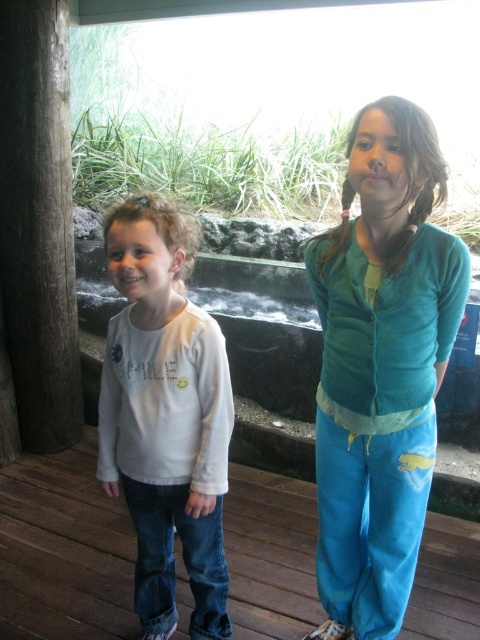
Question: Which point is closer to the camera?

Choices:
 (A) (205, 342)
 (B) (348, 456)
 (C) (275, 545)

Answer: (A)

Question: Among these points, which one is nearest to the camera?

Choices:
 (A) (400, 509)
 (B) (142, 268)

Answer: (B)

Question: Can you confirm if teal cardigan at center is positioned below wooden deck at center?

Choices:
 (A) no
 (B) yes

Answer: (A)

Question: Which object is positioned closest to the wooden deck at center?

Choices:
 (A) white cotton shirt at left
 (B) teal cardigan at center

Answer: (A)

Question: Can you confirm if teal cardigan at center is bigger than wooden deck at center?

Choices:
 (A) no
 (B) yes

Answer: (A)

Question: Is teal cardigan at center to the left of white cotton shirt at left from the viewer's perspective?

Choices:
 (A) no
 (B) yes

Answer: (A)